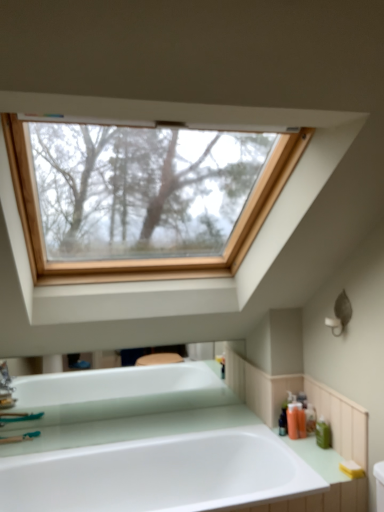
Question: Can you see orange matte bottle at lower right, which is the third toiletry in back-to-front order, touching green matte bottle at right, the first toiletry in the front-to-back sequence?

Choices:
 (A) yes
 (B) no

Answer: (B)

Question: Can you confirm if orange matte bottle at lower right, which is the third toiletry in back-to-front order, is shorter than green matte bottle at right, the first toiletry in the front-to-back sequence?

Choices:
 (A) yes
 (B) no

Answer: (B)

Question: Is there a large distance between orange matte bottle at lower right, which is the 2th toiletry from front to back, and green matte bottle at right, the 4th toiletry in the back-to-front sequence?

Choices:
 (A) no
 (B) yes

Answer: (A)

Question: Considering the relative sizes of orange matte bottle at lower right, which is the 2th toiletry from front to back, and green matte bottle at right, the first toiletry in the front-to-back sequence, in the image provided, is orange matte bottle at lower right, which is the 2th toiletry from front to back, bigger than green matte bottle at right, the first toiletry in the front-to-back sequence,?

Choices:
 (A) yes
 (B) no

Answer: (A)

Question: Is orange matte bottle at lower right, which is the 2th toiletry from front to back, turned away from green matte bottle at right, the 4th toiletry in the back-to-front sequence?

Choices:
 (A) no
 (B) yes

Answer: (A)

Question: Can you confirm if orange matte bottle at lower right, which is the third toiletry in back-to-front order, is wider than green matte bottle at right, the 4th toiletry in the back-to-front sequence?

Choices:
 (A) yes
 (B) no

Answer: (A)

Question: Does translucent plastic soap dispenser at right, marked as the 3th toiletry in a front-to-back arrangement, have a lesser height compared to green matte bottle at right, the 4th toiletry in the back-to-front sequence?

Choices:
 (A) no
 (B) yes

Answer: (A)

Question: Is translucent plastic soap dispenser at right, placed as the second toiletry when sorted from back to front, thinner than green matte bottle at right, the 4th toiletry in the back-to-front sequence?

Choices:
 (A) no
 (B) yes

Answer: (A)

Question: Does translucent plastic soap dispenser at right, placed as the second toiletry when sorted from back to front, turn towards green matte bottle at right, the first toiletry in the front-to-back sequence?

Choices:
 (A) no
 (B) yes

Answer: (A)

Question: Does translucent plastic soap dispenser at right, marked as the 3th toiletry in a front-to-back arrangement, come behind green matte bottle at right, the first toiletry in the front-to-back sequence?

Choices:
 (A) yes
 (B) no

Answer: (A)

Question: Is translucent plastic soap dispenser at right, marked as the 3th toiletry in a front-to-back arrangement, closer to camera compared to green matte bottle at right, the first toiletry in the front-to-back sequence?

Choices:
 (A) no
 (B) yes

Answer: (A)

Question: From a real-world perspective, is translucent plastic soap dispenser at right, marked as the 3th toiletry in a front-to-back arrangement, located beneath green matte bottle at right, the first toiletry in the front-to-back sequence?

Choices:
 (A) no
 (B) yes

Answer: (A)

Question: Is translucent plastic soap dispenser at right, placed as the second toiletry when sorted from back to front, turned away from translucent plastic soap dispenser at right, placed as the 4th toiletry when sorted from front to back?

Choices:
 (A) no
 (B) yes

Answer: (B)